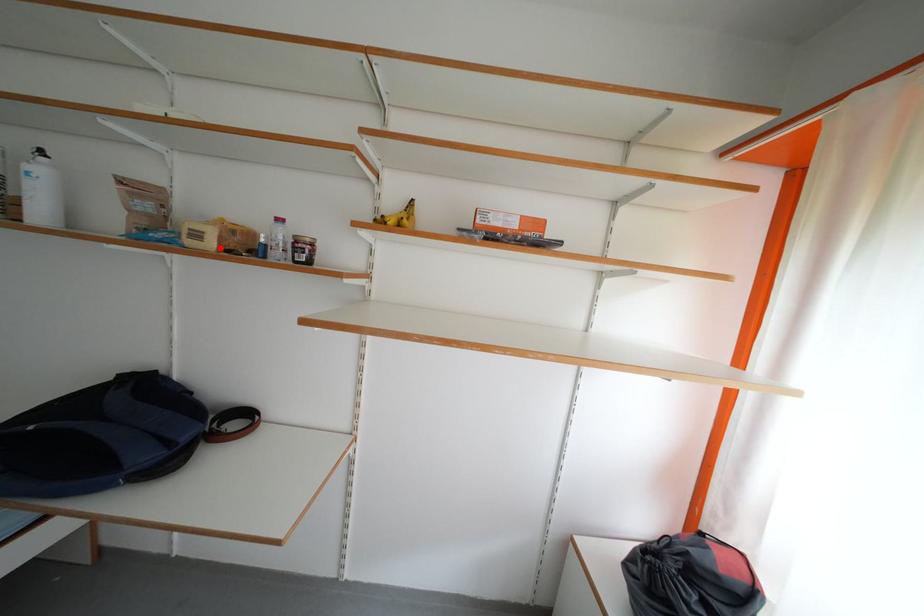
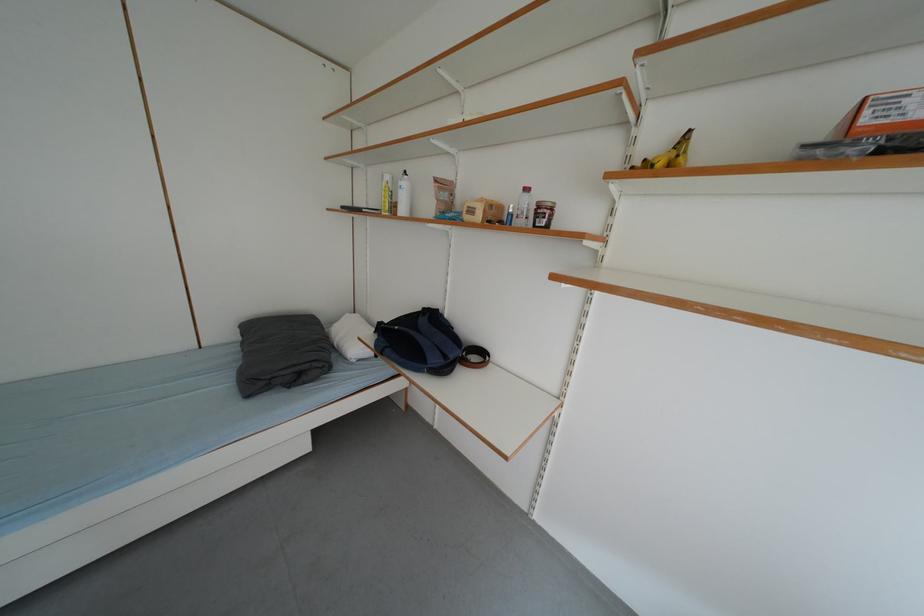
In the second image, find the point that corresponds to the highlighted location in the first image.

(487, 220)